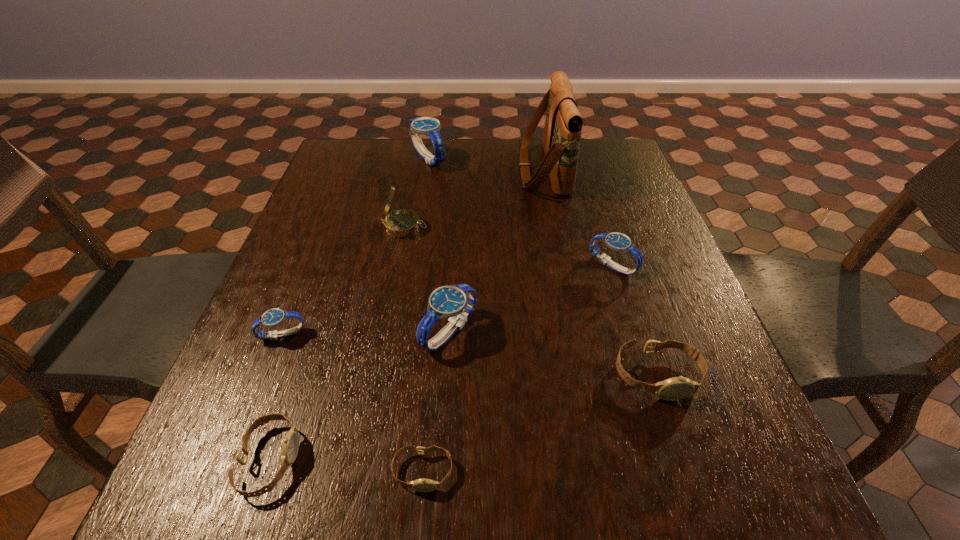
This screenshot has height=540, width=960. I want to click on the tallest object, so click(562, 132).

Where is `the farthest blue watch`? This screenshot has height=540, width=960. the farthest blue watch is located at coordinates (428, 126).

Find the location of a particular element. the biggest blue watch is located at coordinates (428, 126).

Find the location of a particular element. This screenshot has width=960, height=540. the third farthest object is located at coordinates (402, 223).

You are a GUI agent. You are given a task and a screenshot of the screen. Output one action in this format:
    pyautogui.click(x=<x>, y=<y>)
    Task: Click on the sixth shortest object
    This screenshot has height=540, width=960.
    Given the screenshot: What is the action you would take?
    (x=455, y=301)

Identify the location of the third smallest blue watch. The height and width of the screenshot is (540, 960). (455, 301).

Where is `the second farthest watch`? The width and height of the screenshot is (960, 540). the second farthest watch is located at coordinates (619, 242).

At what (x,y) coordinates should I click in order to perform the action: click on the third nearest blue watch. Please return your answer as a coordinate pair (x, y). The image size is (960, 540). Looking at the image, I should click on (619, 242).

The image size is (960, 540). Find the location of `the rightmost beige watch`. the rightmost beige watch is located at coordinates (676, 388).

I want to click on the farthest beige watch, so click(x=676, y=388).